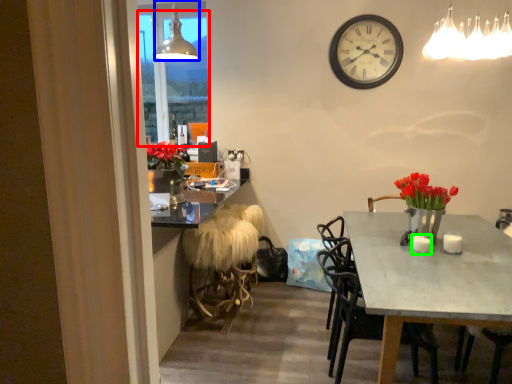
Question: Which is nearer to the window screen (highlighted by a red box)? lamp (highlighted by a blue box) or coffee cup (highlighted by a green box).

Choices:
 (A) lamp
 (B) coffee cup

Answer: (A)